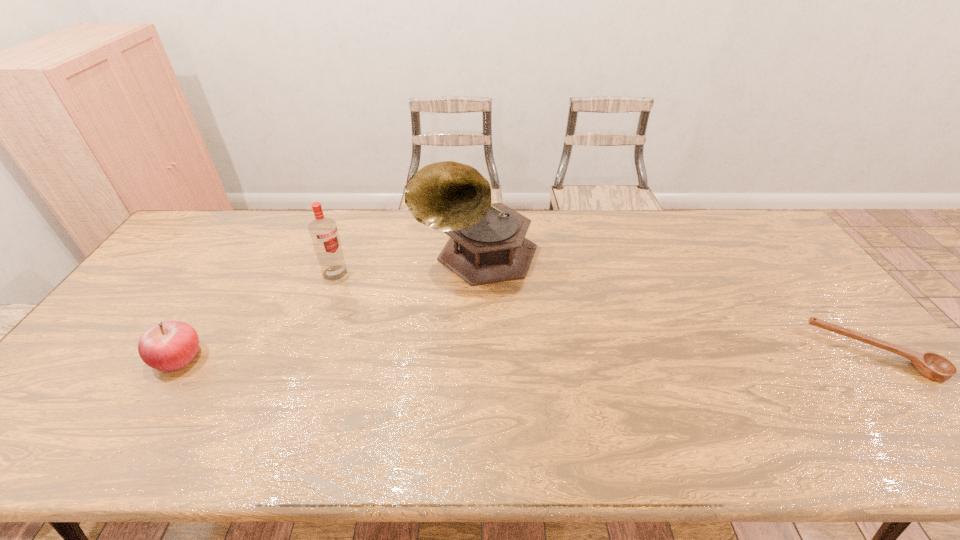
The width and height of the screenshot is (960, 540). Identify the location of vacant space positioned on the horn direction of the tallest object. (438, 326).

Identify the location of free space located 0.380m on the horn direction of the tallest object. This screenshot has height=540, width=960. (401, 395).

At what (x,y) coordinates should I click in order to perform the action: click on free region located 0.290m on the horn direction of the tallest object. Please return your answer as a coordinate pair (x, y). The image size is (960, 540). Looking at the image, I should click on (417, 366).

Where is `free space located 0.140m on the front label of the vodka`? The image size is (960, 540). free space located 0.140m on the front label of the vodka is located at coordinates (367, 302).

Find the location of a particular element. This screenshot has width=960, height=540. free space located 0.370m on the front label of the vodka is located at coordinates (414, 348).

The width and height of the screenshot is (960, 540). What are the coordinates of `free space located 0.150m on the front label of the vodka` in the screenshot? It's located at (369, 304).

Find the location of a particular element. The image size is (960, 540). object at the far edge is located at coordinates (487, 244).

At what (x,y) coordinates should I click in order to perform the action: click on object that is at the near edge. Please return your answer as a coordinate pair (x, y). Looking at the image, I should click on (932, 366).

The image size is (960, 540). I want to click on object that is at the right edge, so (x=932, y=366).

Locate an element on the screen. object that is at the near right corner is located at coordinates (932, 366).